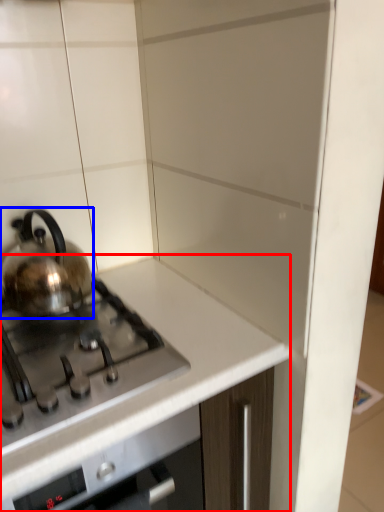
Question: Which point is closer to the camera, countertop (highlighted by a red box) or kettle (highlighted by a blue box)?

Choices:
 (A) countertop
 (B) kettle

Answer: (A)